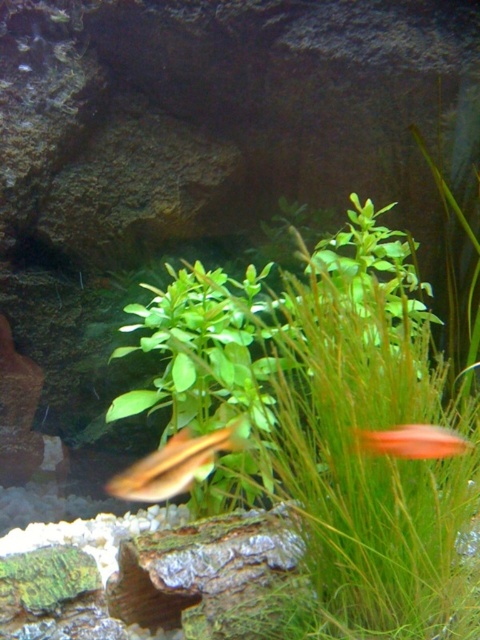
Question: Is translucent yellowish fish at center to the right of orange glossy fish at right from the viewer's perspective?

Choices:
 (A) no
 (B) yes

Answer: (A)

Question: Is translucent yellowish fish at center further to the viewer compared to orange glossy fish at right?

Choices:
 (A) yes
 (B) no

Answer: (A)

Question: Which point is farther from the camera taking this photo?

Choices:
 (A) (143, 480)
 (B) (411, 424)

Answer: (A)

Question: Can you confirm if translucent yellowish fish at center is wider than orange glossy fish at right?

Choices:
 (A) yes
 (B) no

Answer: (A)